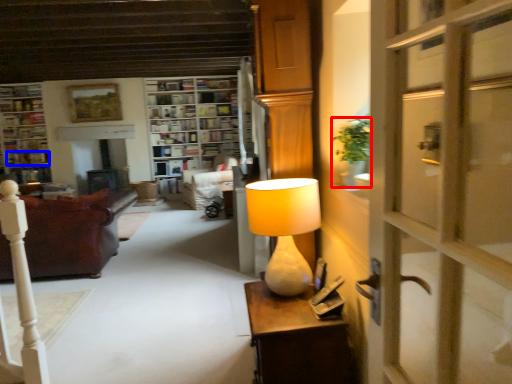
Question: Which object appears farthest to the camera in this image, houseplant (highlighted by a red box) or book (highlighted by a blue box)?

Choices:
 (A) houseplant
 (B) book

Answer: (B)